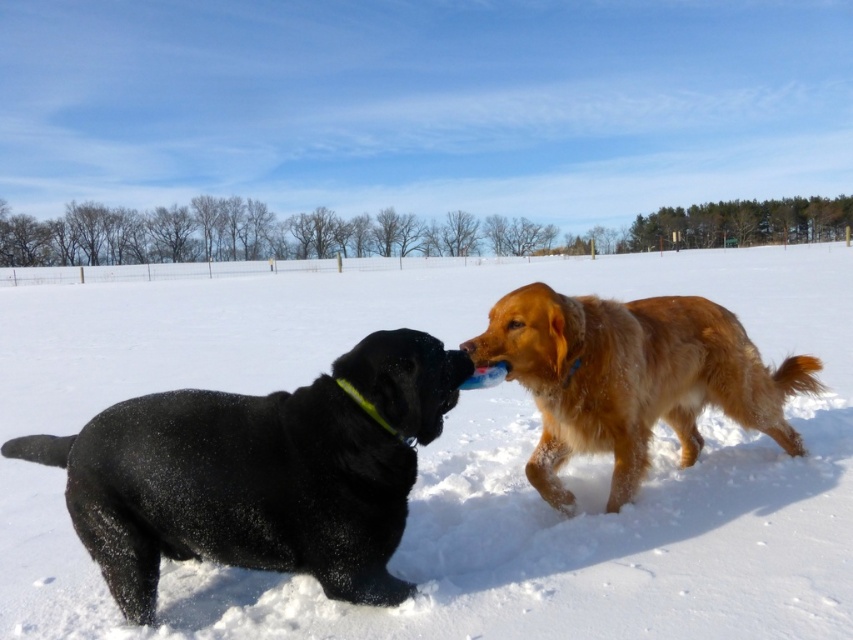
Question: Which object is the farthest from the black matte dog at left?

Choices:
 (A) white fluffy snow at center
 (B) golden fur dog at center

Answer: (A)

Question: Does white fluffy snow at center have a greater width compared to golden fur dog at center?

Choices:
 (A) yes
 (B) no

Answer: (A)

Question: Does white fluffy snow at center appear under golden fur dog at center?

Choices:
 (A) no
 (B) yes

Answer: (A)

Question: Which is nearer to the golden fur dog at center?

Choices:
 (A) white fluffy snow at center
 (B) black matte dog at left

Answer: (B)

Question: Does white fluffy snow at center have a lesser width compared to golden fur dog at center?

Choices:
 (A) yes
 (B) no

Answer: (B)

Question: Which of these objects is positioned farthest from the black matte dog at left?

Choices:
 (A) white fluffy snow at center
 (B) golden fur dog at center

Answer: (A)